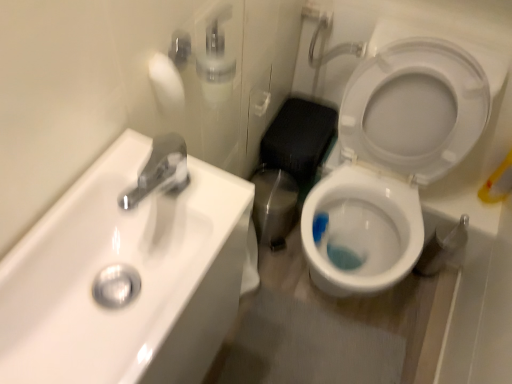
Question: Considering the relative sizes of white glossy toilet at right and white glossy sink at upper left in the image provided, is white glossy toilet at right taller than white glossy sink at upper left?

Choices:
 (A) yes
 (B) no

Answer: (A)

Question: Is white glossy toilet at right completely or partially outside of white glossy sink at upper left?

Choices:
 (A) no
 (B) yes

Answer: (B)

Question: Can you confirm if white glossy toilet at right is smaller than white glossy sink at upper left?

Choices:
 (A) yes
 (B) no

Answer: (B)

Question: Considering the relative sizes of white glossy toilet at right and white glossy sink at upper left in the image provided, is white glossy toilet at right thinner than white glossy sink at upper left?

Choices:
 (A) no
 (B) yes

Answer: (A)

Question: Does white glossy toilet at right come behind white glossy sink at upper left?

Choices:
 (A) yes
 (B) no

Answer: (A)

Question: From the image's perspective, would you say white glossy toilet at right is shown under white glossy sink at upper left?

Choices:
 (A) no
 (B) yes

Answer: (A)

Question: Would you say white glossy sink at upper left contains white glossy toilet at right?

Choices:
 (A) yes
 (B) no

Answer: (B)

Question: Is white glossy sink at upper left positioned with its back to white glossy toilet at right?

Choices:
 (A) no
 (B) yes

Answer: (A)

Question: From a real-world perspective, does white glossy sink at upper left stand above white glossy toilet at right?

Choices:
 (A) no
 (B) yes

Answer: (B)

Question: Considering the relative sizes of white glossy sink at upper left and white glossy toilet at right in the image provided, is white glossy sink at upper left shorter than white glossy toilet at right?

Choices:
 (A) no
 (B) yes

Answer: (B)

Question: Can you confirm if white glossy sink at upper left is wider than white glossy toilet at right?

Choices:
 (A) yes
 (B) no

Answer: (B)

Question: Is white glossy sink at upper left smaller than white glossy toilet at right?

Choices:
 (A) no
 (B) yes

Answer: (B)

Question: From the image's perspective, is white glossy sink at upper left positioned above or below white glossy toilet at right?

Choices:
 (A) below
 (B) above

Answer: (A)